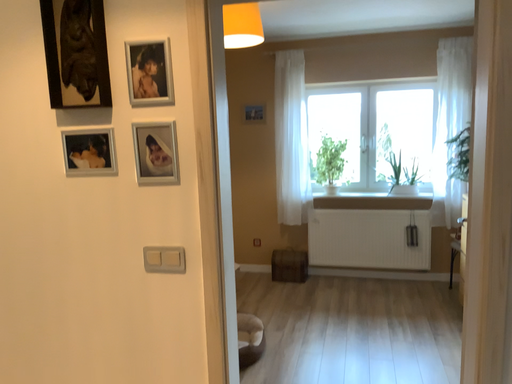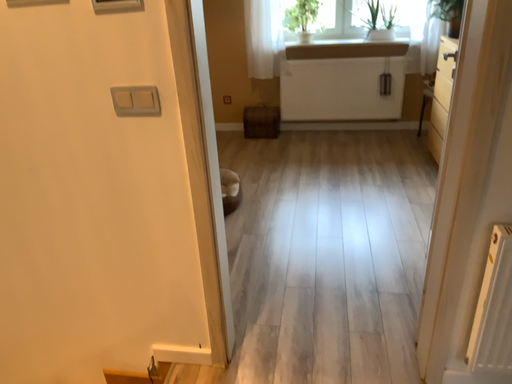
Question: How did the camera likely rotate when shooting the video?

Choices:
 (A) rotated upward
 (B) rotated downward

Answer: (B)